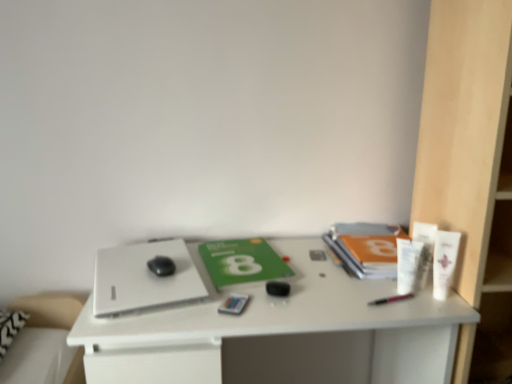
You are a GUI agent. You are given a task and a screenshot of the screen. Output one action in this format:
    pyautogui.click(x=<x>, y=<y>)
    Task: Click on the free point above green matte paperback book at center, the first paperback book viewed from the left (from a real-world perspective)
    This screenshot has height=384, width=512.
    Given the screenshot: What is the action you would take?
    point(239,254)